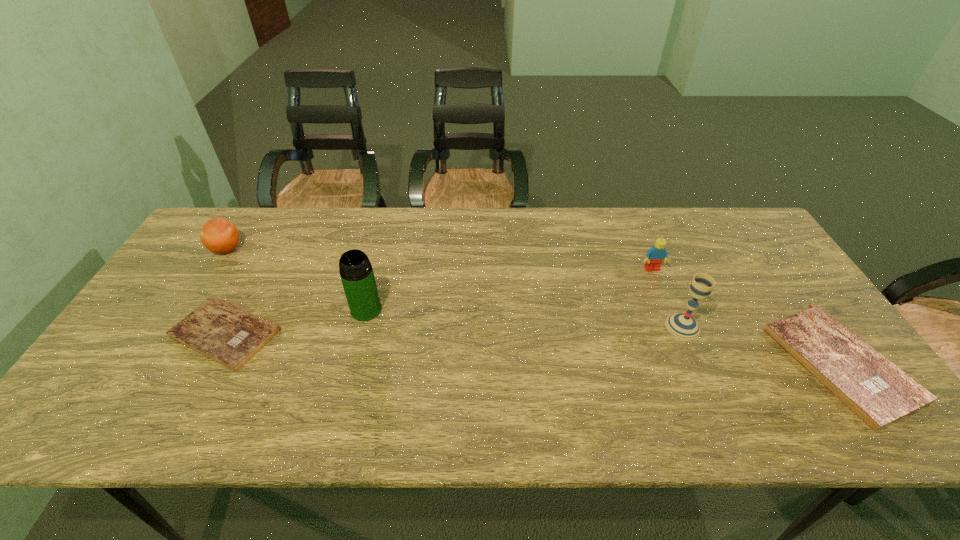
To achieve uniform spacing by inserting another Bible among them, please point to a free space for this new Bible. Please provide its 2D coordinates. Your answer should be formatted as a tuple, i.e. [(x, y)], where the tuple contains the x and y coordinates of a point satisfying the conditions above.

[(524, 348)]